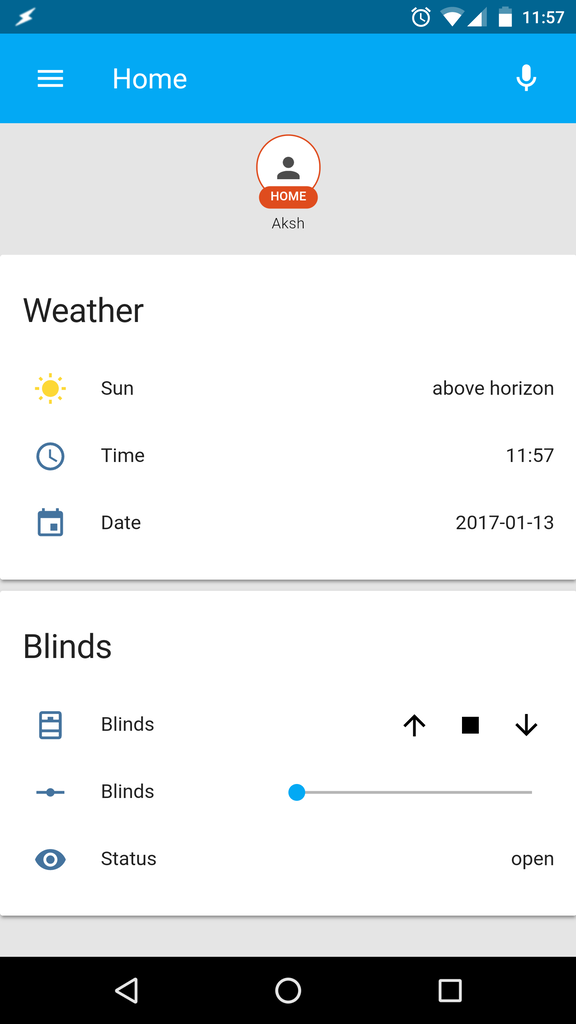
What are the coordinates of `corner` in the screenshot? It's located at [x=573, y=1018].